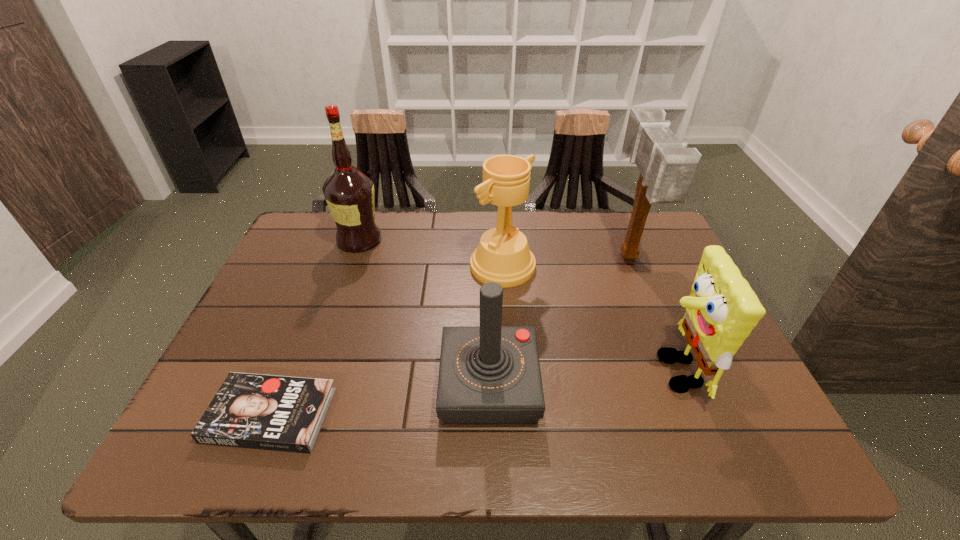
Where is `vacant space at the far right corner`? vacant space at the far right corner is located at coordinates (663, 236).

Find the location of a particular element. This screenshot has height=540, width=960. vacant area between the award and the alcohol is located at coordinates (431, 253).

Locate an element on the screen. unoccupied position between the sponge and the award is located at coordinates (588, 319).

Image resolution: width=960 pixels, height=540 pixels. In order to click on free space between the award and the mallet in this screenshot , I will do `click(565, 262)`.

Where is `vacant space that is in between the mallet and the joystick`? Image resolution: width=960 pixels, height=540 pixels. vacant space that is in between the mallet and the joystick is located at coordinates (559, 321).

This screenshot has width=960, height=540. Find the location of `empty space that is in between the joystick and the sponge`. empty space that is in between the joystick and the sponge is located at coordinates (582, 379).

Image resolution: width=960 pixels, height=540 pixels. What are the coordinates of `vacant area that lies between the alcohol and the award` in the screenshot? It's located at (431, 253).

Where is `free space between the joystick and the alcohol`? The image size is (960, 540). free space between the joystick and the alcohol is located at coordinates pos(424,313).

In order to click on empty location between the joystick and the sponge in this screenshot , I will do (582, 379).

Locate an element on the screen. The height and width of the screenshot is (540, 960). object that is the second nearest to the alcohol is located at coordinates (490, 374).